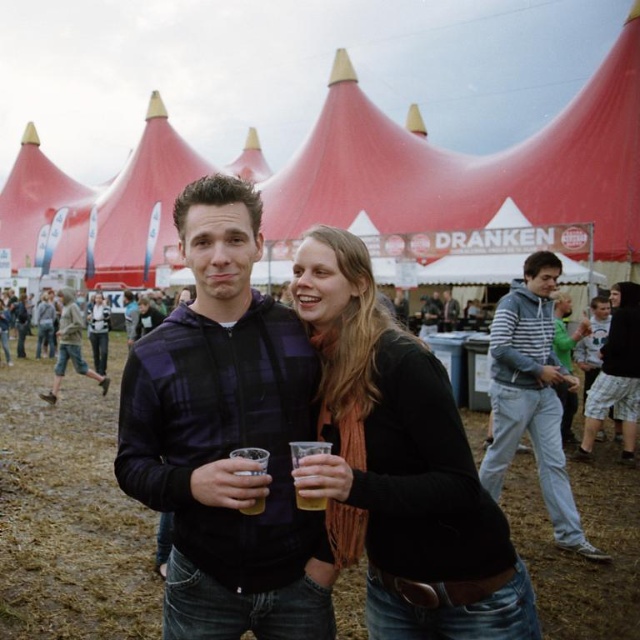
Question: Can you confirm if brown muddy ground at center is positioned to the right of striped hoodie at right?

Choices:
 (A) no
 (B) yes

Answer: (A)

Question: Is black matte scarf at center thinner than translucent plastic cup at center?

Choices:
 (A) no
 (B) yes

Answer: (A)

Question: Which object appears farthest from the camera in this image?

Choices:
 (A) striped hoodie at right
 (B) red fabric tent at center

Answer: (B)

Question: Which of the following is the farthest from the observer?

Choices:
 (A) plaid fabric jacket at center
 (B) red fabric tent at center
 (C) striped hoodie at right
 (D) brown muddy ground at center

Answer: (B)

Question: Does red fabric tent at center appear on the left side of black matte scarf at center?

Choices:
 (A) yes
 (B) no

Answer: (A)

Question: Which object is closer to the camera taking this photo?

Choices:
 (A) brown muddy ground at center
 (B) red fabric tent at center

Answer: (A)